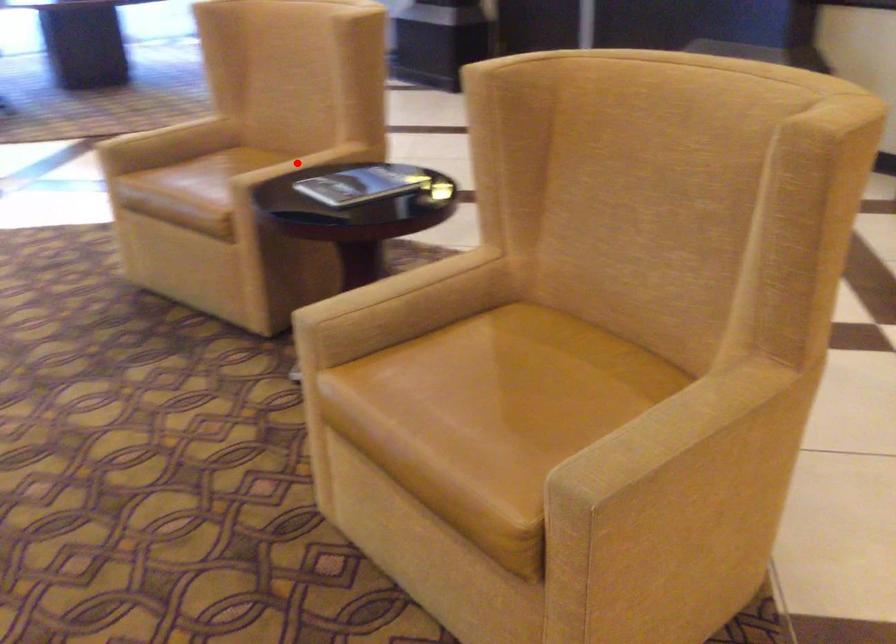
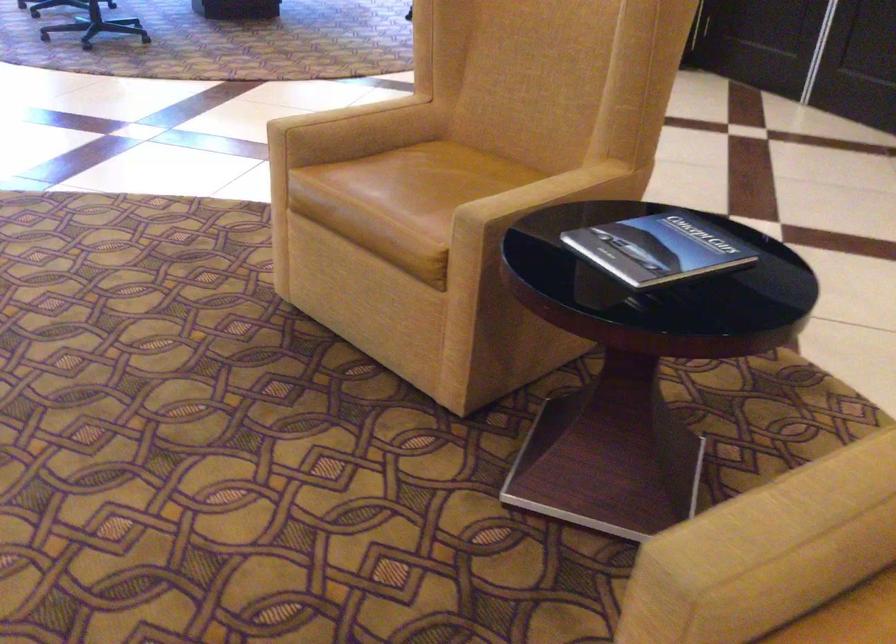
Locate, in the second image, the point that corresponds to the highlighted location in the first image.

(541, 193)